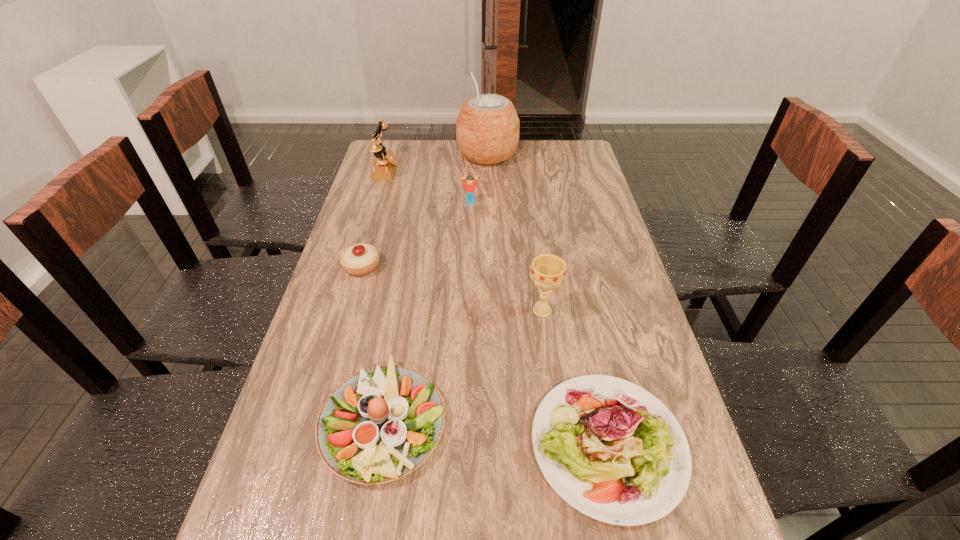
This screenshot has height=540, width=960. I want to click on vacant space located on the dial of the telephone, so click(x=504, y=170).

The height and width of the screenshot is (540, 960). Identify the location of vacant space positioned 0.260m on the left of the third nearest object. (427, 310).

Where is `free space located 0.160m on the face of the Lego`? This screenshot has height=540, width=960. free space located 0.160m on the face of the Lego is located at coordinates (469, 233).

Find the location of a particular element. vacant space located on the back of the left salad plate is located at coordinates (402, 312).

Identify the location of free space located on the front of the pastry. This screenshot has height=540, width=960. (348, 312).

This screenshot has height=540, width=960. In order to click on vacant space located on the back of the shorter salad plate in this screenshot , I will do `click(571, 272)`.

You are a GUI agent. You are given a task and a screenshot of the screen. Output one action in this format:
    pyautogui.click(x=<x>, y=<y>)
    Task: Click on the coconut that is at the far edge
    
    Given the screenshot: What is the action you would take?
    pyautogui.click(x=487, y=129)

Locate an element on the screen. This screenshot has width=960, height=540. telephone located at the far edge is located at coordinates (384, 166).

Find the location of `telephone at the left edge`. telephone at the left edge is located at coordinates (384, 166).

You are a GUI agent. You are given a task and a screenshot of the screen. Output one action in this format:
    pyautogui.click(x=<x>, y=<y>)
    Task: Click on the salad plate located in the left edge section of the desktop
    Image resolution: width=960 pixels, height=540 pixels.
    Given the screenshot: What is the action you would take?
    pyautogui.click(x=380, y=424)